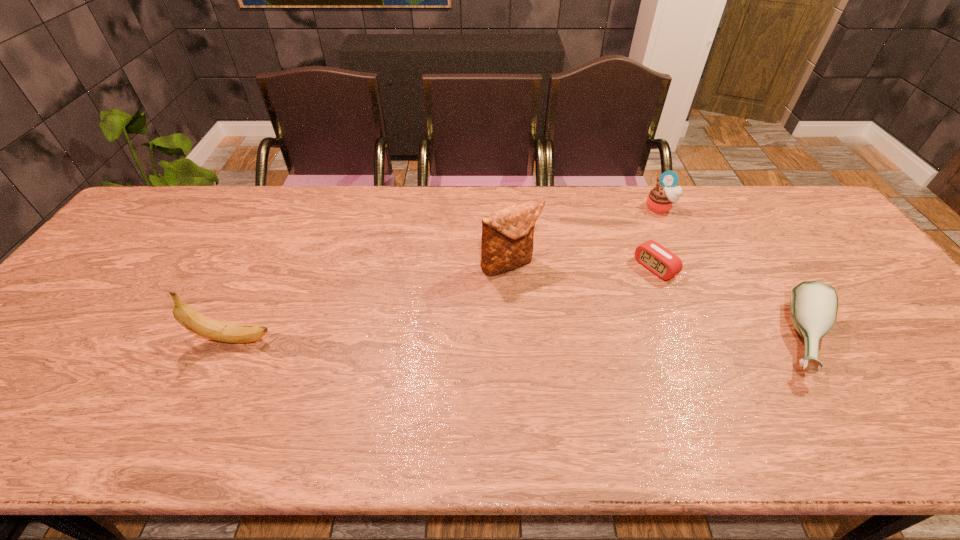
The height and width of the screenshot is (540, 960). In order to click on vacant space in between the bottle and the banana in this screenshot , I will do `click(520, 339)`.

This screenshot has width=960, height=540. Find the location of `free spot between the alarm clock and the second shortest object`. free spot between the alarm clock and the second shortest object is located at coordinates (731, 303).

This screenshot has width=960, height=540. In order to click on free area in between the shortest object and the fourth object from right to left in this screenshot , I will do `click(583, 266)`.

The height and width of the screenshot is (540, 960). Identify the location of empty location between the banana and the muffin. (447, 273).

Locate which object ranks fourth in proximity to the muffin. Please provide its 2D coordinates. Your answer should be formatted as a tuple, i.e. [(x, y)], where the tuple contains the x and y coordinates of a point satisfying the conditions above.

[(188, 317)]

Select which object is the third closest to the shortest object. Please provide its 2D coordinates. Your answer should be formatted as a tuple, i.e. [(x, y)], where the tuple contains the x and y coordinates of a point satisfying the conditions above.

[(507, 234)]

The height and width of the screenshot is (540, 960). Identify the location of blank space that satisfies the following two spatial constraints: 1. on the front side of the shortest object; 2. on the right side of the rightmost object. (684, 340).